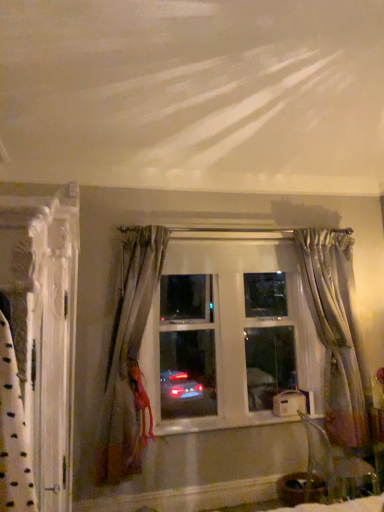
Question: Is satin gray curtain at left, the second curtain in the left-to-right sequence, to the right of silvery sheer curtain at right, positioned as the 1th curtain in back-to-front order, from the viewer's perspective?

Choices:
 (A) yes
 (B) no

Answer: (B)

Question: Is satin gray curtain at left, the second curtain in the left-to-right sequence, aimed at silvery sheer curtain at right, the first curtain when ordered from right to left?

Choices:
 (A) no
 (B) yes

Answer: (A)

Question: From a real-world perspective, is satin gray curtain at left, the second curtain in the left-to-right sequence, on top of silvery sheer curtain at right, the first curtain when ordered from right to left?

Choices:
 (A) yes
 (B) no

Answer: (B)

Question: From a real-world perspective, is satin gray curtain at left, positioned as the 2th curtain in back-to-front order, physically below silvery sheer curtain at right, placed as the third curtain when sorted from front to back?

Choices:
 (A) yes
 (B) no

Answer: (A)

Question: Is satin gray curtain at left, the 2th curtain positioned from the right, located outside silvery sheer curtain at right, positioned as the 1th curtain in back-to-front order?

Choices:
 (A) no
 (B) yes

Answer: (B)

Question: From the image's perspective, is satin gray curtain at left, the second curtain in the left-to-right sequence, positioned above or below white textured curtain at left, acting as the third curtain starting from the back?

Choices:
 (A) below
 (B) above

Answer: (A)

Question: Is satin gray curtain at left, positioned as the 2th curtain in back-to-front order, in front of or behind white textured curtain at left, which appears as the 3th curtain when viewed from the right, in the image?

Choices:
 (A) behind
 (B) front

Answer: (A)

Question: Which is correct: satin gray curtain at left, the 2th curtain positioned from the right, is inside white textured curtain at left, which is the first curtain in front-to-back order, or outside of it?

Choices:
 (A) inside
 (B) outside

Answer: (B)

Question: Would you say satin gray curtain at left, the 2th curtain in the front-to-back sequence, is to the left or to the right of white textured curtain at left, which is the first curtain in front-to-back order, in the picture?

Choices:
 (A) right
 (B) left

Answer: (A)

Question: Considering their positions, is silvery sheer curtain at right, the first curtain when ordered from right to left, located in front of or behind white painted wood at center?

Choices:
 (A) behind
 (B) front

Answer: (A)

Question: From the image's perspective, is silvery sheer curtain at right, which appears as the 3th curtain when viewed from the left, above or below white painted wood at center?

Choices:
 (A) below
 (B) above

Answer: (B)

Question: In terms of height, does silvery sheer curtain at right, positioned as the 1th curtain in back-to-front order, look taller or shorter compared to white painted wood at center?

Choices:
 (A) short
 (B) tall

Answer: (B)

Question: Is point (332, 240) positioned closer to the camera than point (172, 424)?

Choices:
 (A) farther
 (B) closer

Answer: (A)

Question: From a real-world perspective, is satin gray curtain at left, positioned as the 2th curtain in back-to-front order, positioned above or below clear glass window at center?

Choices:
 (A) above
 (B) below

Answer: (B)

Question: Is satin gray curtain at left, positioned as the 2th curtain in back-to-front order, to the left or to the right of clear glass window at center in the image?

Choices:
 (A) right
 (B) left

Answer: (B)